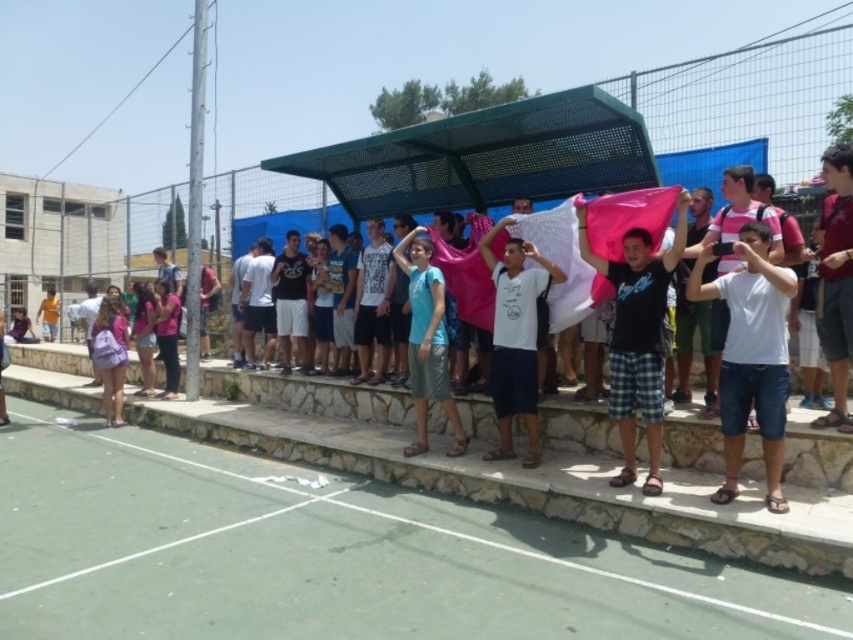
Question: Is green rubber court at lower center bigger than white cotton shirt at center?

Choices:
 (A) no
 (B) yes

Answer: (A)

Question: Considering the relative positions of green rubber court at lower center and white cotton shirt at center in the image provided, where is green rubber court at lower center located with respect to white cotton shirt at center?

Choices:
 (A) above
 (B) below

Answer: (B)

Question: Can you confirm if green rubber court at lower center is smaller than white cotton shirt at center?

Choices:
 (A) yes
 (B) no

Answer: (A)

Question: Which point is farther to the camera?

Choices:
 (A) (498, 406)
 (B) (221, 580)

Answer: (A)